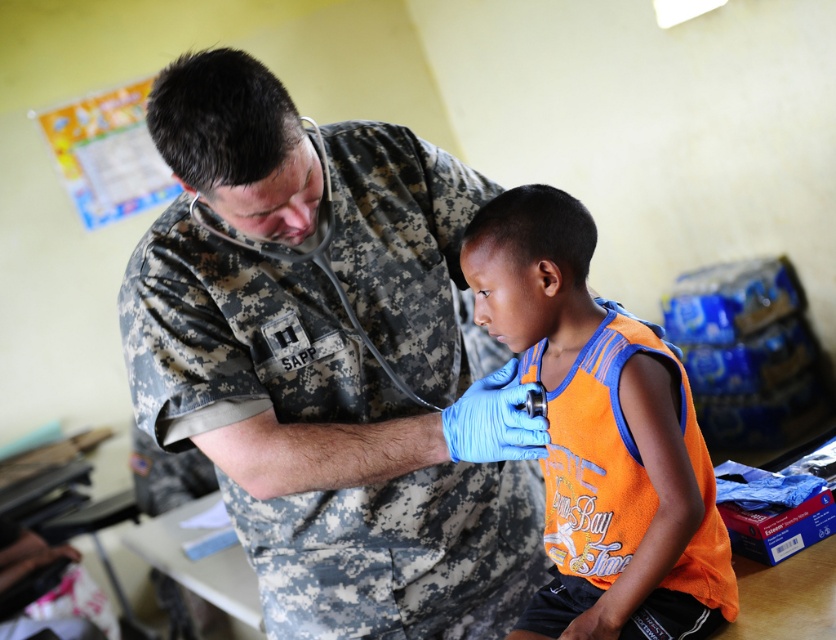
Does camouflage uniform at center have a lesser width compared to orange fabric shirt at center?

No, camouflage uniform at center is not thinner than orange fabric shirt at center.

Who is positioned more to the left, camouflage uniform at center or orange fabric shirt at center?

camouflage uniform at center is more to the left.

Describe the element at coordinates (330, 364) in the screenshot. I see `camouflage uniform at center` at that location.

Locate an element on the screen. This screenshot has height=640, width=836. camouflage uniform at center is located at coordinates (330, 364).